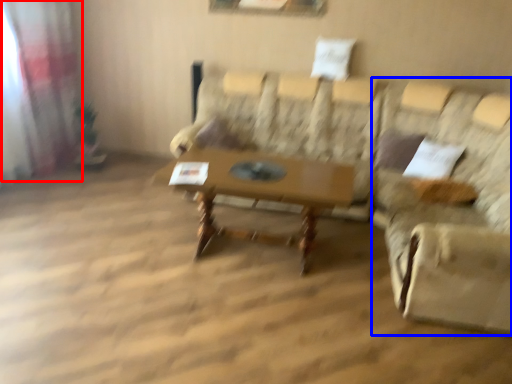
Question: Among these objects, which one is farthest to the camera, curtain (highlighted by a red box) or swivel chair (highlighted by a blue box)?

Choices:
 (A) curtain
 (B) swivel chair

Answer: (A)